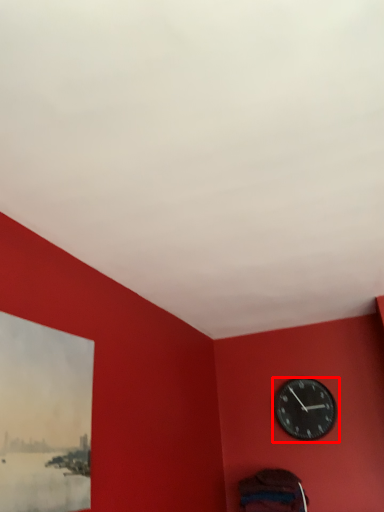
Question: From the image's perspective, what is the correct spatial positioning of wall clock (annotated by the red box) in reference to picture frame?

Choices:
 (A) below
 (B) above

Answer: (A)